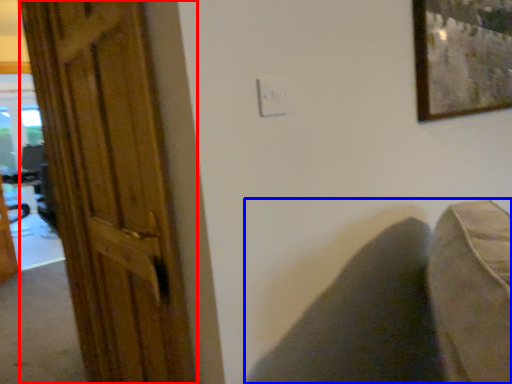
Question: Which point is further to the camera, door (highlighted by a red box) or swivel chair (highlighted by a blue box)?

Choices:
 (A) door
 (B) swivel chair

Answer: (B)